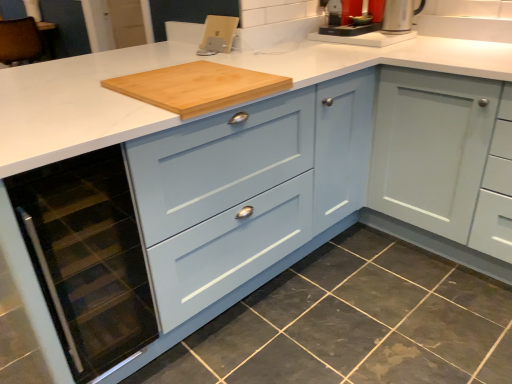
Where is `free space above dark gray granite at lower left (from a real-world perspective)`? free space above dark gray granite at lower left (from a real-world perspective) is located at coordinates (331, 313).